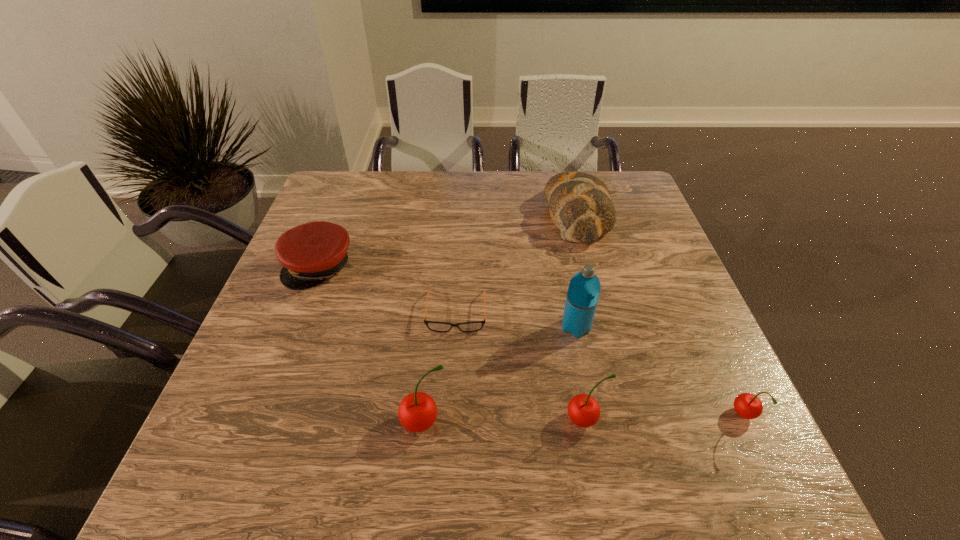
I want to click on free spot located on the back of the second shortest cherry, so click(561, 288).

Locate an element on the screen. The width and height of the screenshot is (960, 540). vacant space located on the left of the rightmost cherry is located at coordinates (601, 416).

Find the location of a particular element. Image resolution: width=960 pixels, height=540 pixels. vacant space situated 0.310m on the front of the bread is located at coordinates (610, 342).

The image size is (960, 540). Find the location of `free space located on the front-facing side of the cap`. free space located on the front-facing side of the cap is located at coordinates (281, 366).

The height and width of the screenshot is (540, 960). Find the location of `vacant area located 0.250m on the left of the thermos bottle`. vacant area located 0.250m on the left of the thermos bottle is located at coordinates (451, 327).

The width and height of the screenshot is (960, 540). In order to click on blank space located 0.100m on the front-facing side of the spectacles in this screenshot , I will do `click(453, 373)`.

The image size is (960, 540). Find the location of `object at the far edge`. object at the far edge is located at coordinates (580, 204).

Identify the location of object that is positioned at the left edge. (311, 253).

Find the location of a particular element. cherry that is at the right edge is located at coordinates (748, 406).

This screenshot has height=540, width=960. What are the coordinates of `bread located in the right edge section of the desktop` in the screenshot? It's located at pos(580,204).